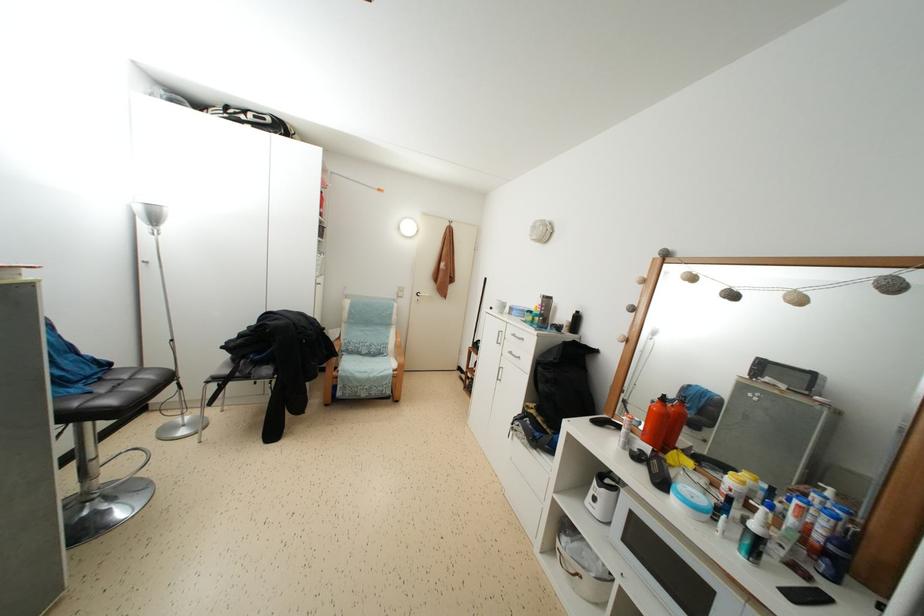
At what (x,y) coordinates should I click in order to perform the action: click on black backpack. Please return your answer as a coordinate pair (x, y). Looking at the image, I should click on click(x=557, y=392).